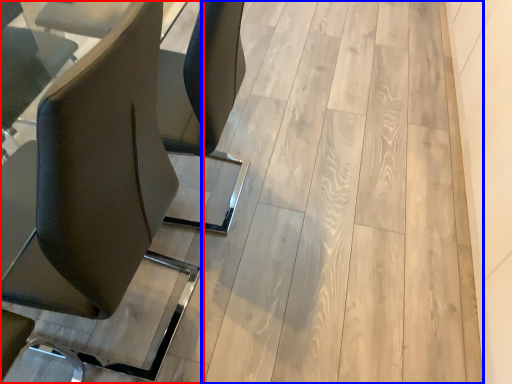
Question: Among these objects, which one is nearest to the camera, chair (highlighted by a red box) or plywood (highlighted by a blue box)?

Choices:
 (A) chair
 (B) plywood

Answer: (A)